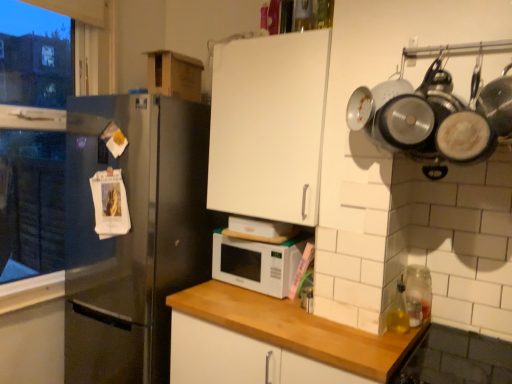
Question: Is stainless steel refrigerator at left inside or outside of clear glass jar at right?

Choices:
 (A) inside
 (B) outside

Answer: (B)

Question: Is stainless steel refrigerator at left to the left or to the right of clear glass jar at right in the image?

Choices:
 (A) right
 (B) left

Answer: (B)

Question: Which of these objects is positioned closest to the clear glass jar at right?

Choices:
 (A) white matte microwave at center
 (B) white matte cabinet at upper center, placed as the 1th cabinetry when sorted from top to bottom
 (C) translucent yellow glass at right
 (D) white wood countertop at center, which appears as the first cabinetry when ordered from the bottom
 (E) stainless steel refrigerator at left

Answer: (C)

Question: Which is nearer to the translucent yellow glass at right?

Choices:
 (A) clear glass jar at right
 (B) white matte microwave at center
 (C) white matte cabinet at upper center, placed as the 1th cabinetry when sorted from top to bottom
 (D) stainless steel refrigerator at left
 (E) white wood countertop at center, which appears as the 2th cabinetry when viewed from the top

Answer: (A)